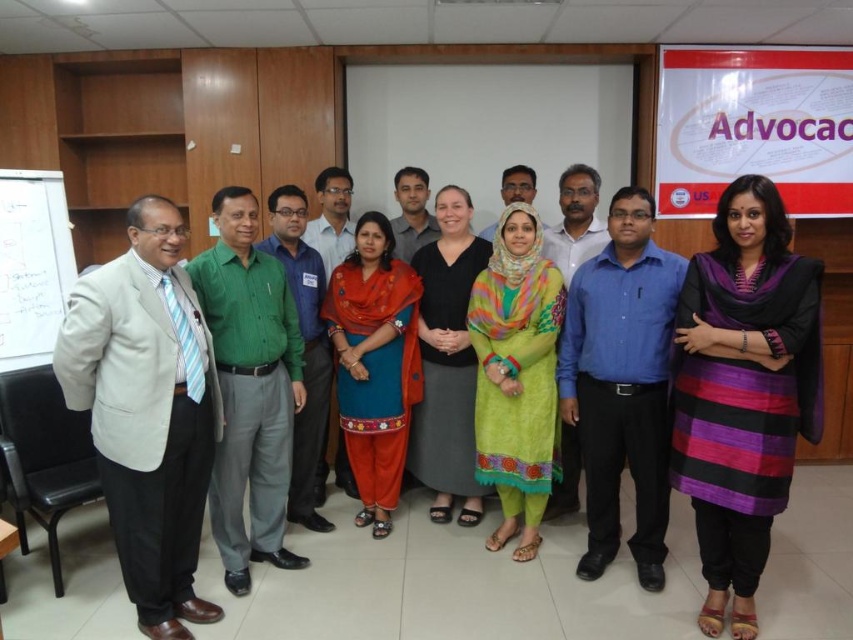
Does blue cotton kurta at center appear under black matte dress at center?

Yes, blue cotton kurta at center is below black matte dress at center.

Between point (407, 346) and point (425, 316), which one is positioned in front?

Positioned in front is point (407, 346).

Where is `blue cotton kurta at center`? Image resolution: width=853 pixels, height=640 pixels. blue cotton kurta at center is located at coordinates (374, 364).

In order to click on blue cotton kurta at center in this screenshot , I will do `click(374, 364)`.

Based on the photo, can you confirm if purple striped kurti at center is positioned to the left of blue cotton shirt at center?

In fact, purple striped kurti at center is to the right of blue cotton shirt at center.

Does purple striped kurti at center have a smaller size compared to blue cotton shirt at center?

No.

Image resolution: width=853 pixels, height=640 pixels. I want to click on purple striped kurti at center, so click(743, 390).

What are the coordinates of `purple striped kurti at center` in the screenshot? It's located at (743, 390).

Is black matte dress at center smaller than whiteboard at left?

Actually, black matte dress at center might be larger than whiteboard at left.

Describe the element at coordinates (447, 362) in the screenshot. I see `black matte dress at center` at that location.

Between point (415, 268) and point (16, 305), which one is positioned behind?

The point (16, 305) is behind.

The height and width of the screenshot is (640, 853). I want to click on black matte dress at center, so click(x=447, y=362).